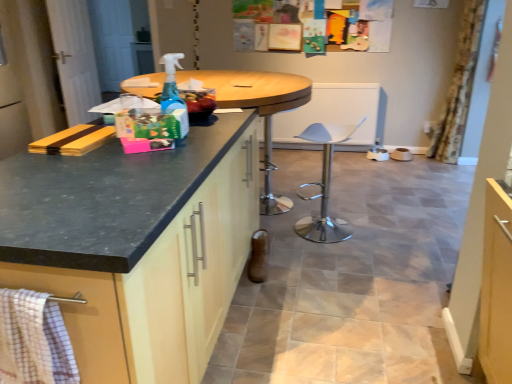
Question: Considering the positions of checkered fabric towel at lower left and matte black countertop at left in the image, is checkered fabric towel at lower left taller or shorter than matte black countertop at left?

Choices:
 (A) tall
 (B) short

Answer: (B)

Question: Is point (51, 322) closer or farther from the camera than point (125, 350)?

Choices:
 (A) closer
 (B) farther

Answer: (A)

Question: Based on their relative distances, which object is farther from the matte black countertop at left?

Choices:
 (A) transparent plastic spray bottle at center
 (B) checkered fabric towel at lower left
 (C) wooden table at center
 (D) floral fabric curtain at right
 (E) white plastic swivel chair at center

Answer: (D)

Question: Which object is positioned farthest from the white plastic swivel chair at center?

Choices:
 (A) white wood screen door at left
 (B) wooden table at center
 (C) matte black countertop at left
 (D) checkered fabric towel at lower left
 (E) transparent plastic spray bottle at center

Answer: (A)